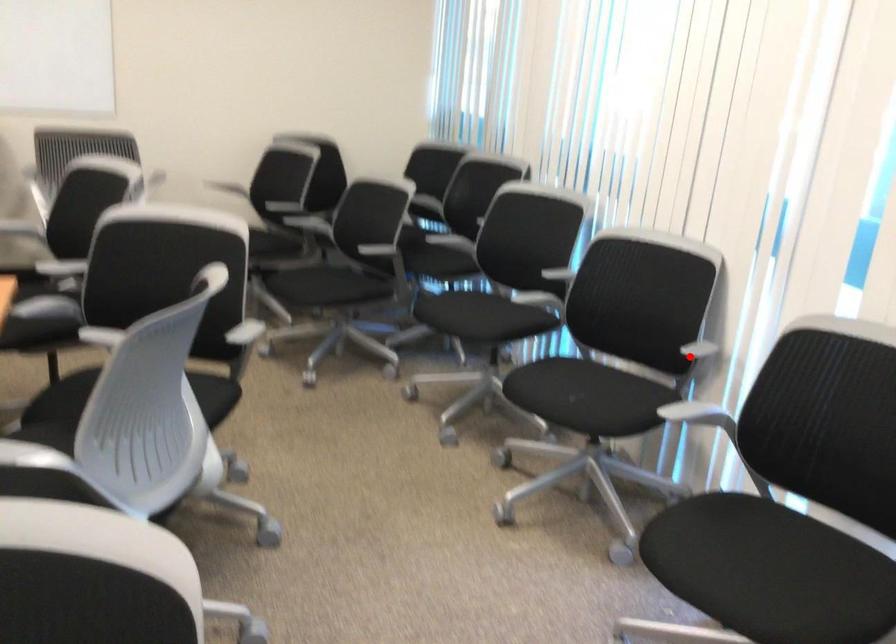
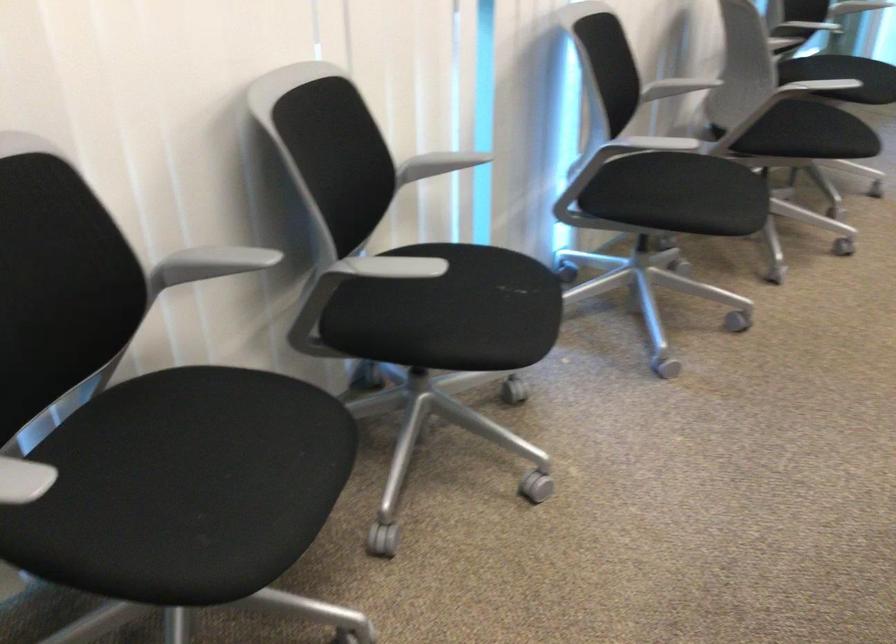
Question: I am providing you with two images of the same scene from different viewpoints. A red point is shown in image1. For the corresponding object point in image2, is it positioned nearer or farther from the camera?

Choices:
 (A) Nearer
 (B) Farther

Answer: (A)